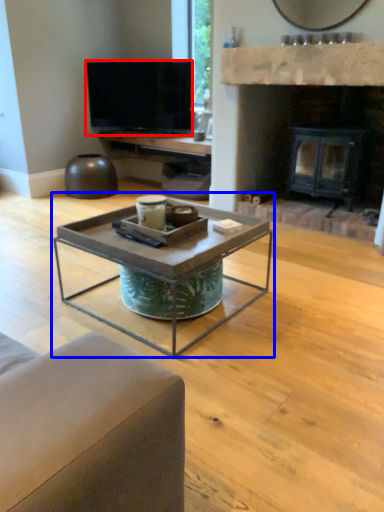
Question: Which of the following is the closest to the observer, television (highlighted by a red box) or coffee table (highlighted by a blue box)?

Choices:
 (A) television
 (B) coffee table

Answer: (B)